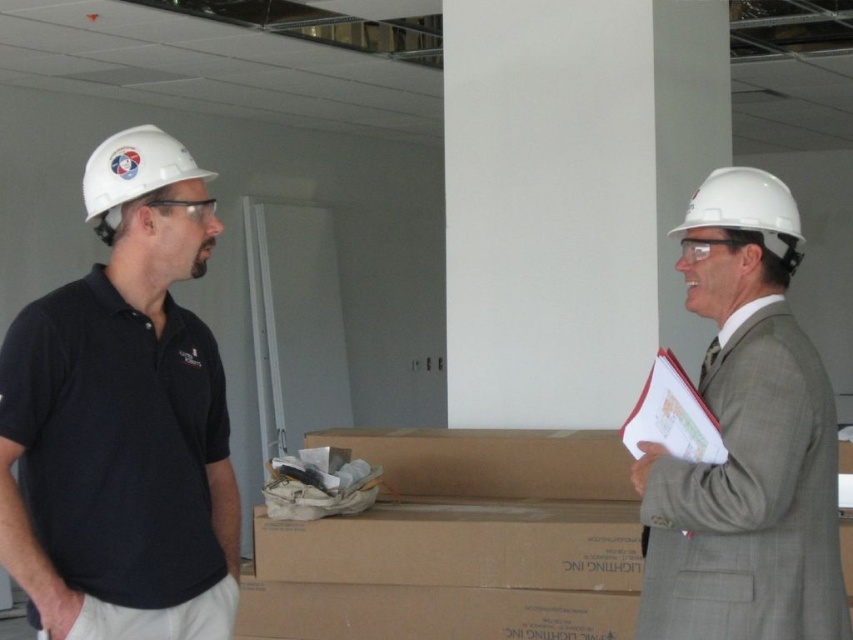
Question: Is white hard hat at right smaller than white hard hat at left?

Choices:
 (A) no
 (B) yes

Answer: (A)

Question: Which object is the farthest from the white hard hat at left?

Choices:
 (A) white hard hat at right
 (B) matte black polo shirt at left

Answer: (A)

Question: Is matte black polo shirt at left behind white hard hat at right?

Choices:
 (A) no
 (B) yes

Answer: (A)

Question: Which is nearer to the matte black polo shirt at left?

Choices:
 (A) white hard hat at left
 (B) white hard hat at right

Answer: (A)

Question: Is white hard hat at right thinner than white hard hat at left?

Choices:
 (A) no
 (B) yes

Answer: (A)

Question: Considering the real-world distances, which object is closest to the white hard hat at right?

Choices:
 (A) white hard hat at left
 (B) matte black polo shirt at left

Answer: (B)